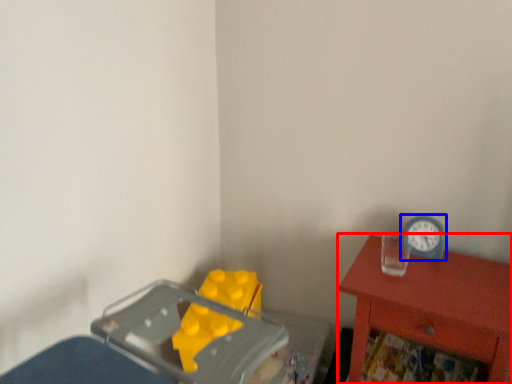
Question: Which object is further to the camera taking this photo, nightstand (highlighted by a red box) or clock (highlighted by a blue box)?

Choices:
 (A) nightstand
 (B) clock

Answer: (B)